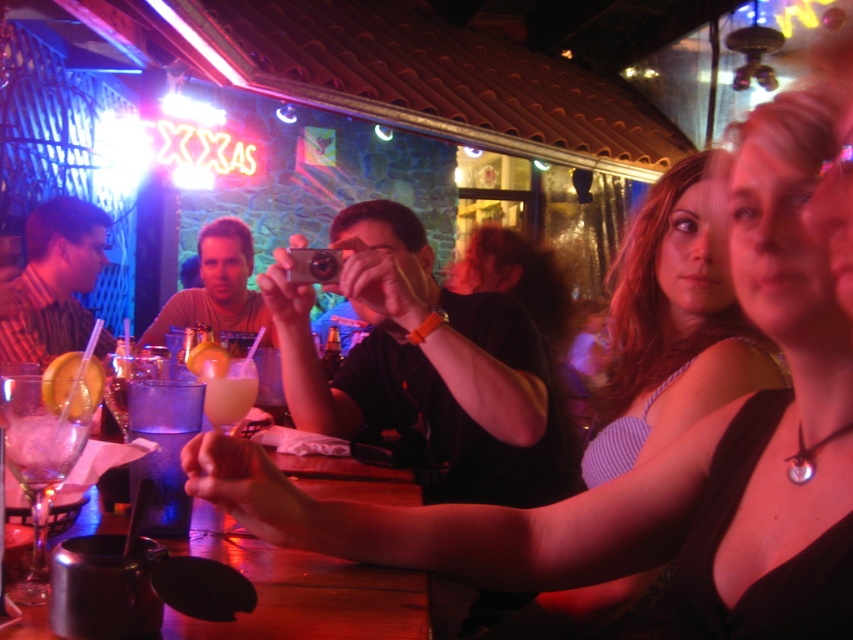
You are a bartender who needs to quickly grab the translucent glass cup at bar center while serving a customer wearing a matte brown shirt at left. Considering the distance between them, can you reach the cup from your current position behind the bar counter without moving your feet?

The distance between the matte brown shirt at left and the translucent glass cup at bar center is 1.44 meters. Since you are behind the bar counter, you can stretch out to reach the cup if your arm length is at least 1.44 meters. However, typical human arm length is about 0.7 meters, so unless you have exceptionally long arms, you might need to take a step forward or sideways to bridge the gap.

You are a photographer positioned behind the matte black tank top at center and the translucent glass cup at bar center. Which object should you focus on first to capture both in the same frame without moving the camera?

You should focus on the matte black tank top at center first because it is closer to the viewer than the translucent glass cup at bar center, allowing both to be in focus when using a shallow depth of field.

You are a bartender trying to place a new drink order on the counter. There is a matte black tank top at center and a translucent glass cup at bar center in the way. Which object do you need to move to make space?

The matte black tank top at center has a greater height compared to the translucent glass cup at bar center, so you need to move the matte black tank top at center to make space for the new drink order.